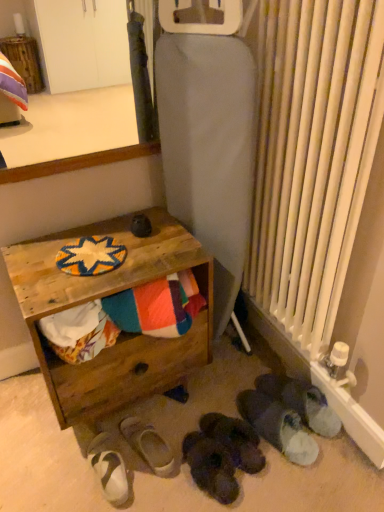
Question: Should I look upward or downward to see wooden surface at upper left?

Choices:
 (A) down
 (B) up

Answer: (B)

Question: Does white fabric slipper at lower center, which appears as the fifth footwear when viewed from the right, have a lesser height compared to black suede slippers at lower center, acting as the 4th footwear starting from the left?

Choices:
 (A) yes
 (B) no

Answer: (A)

Question: From the image's perspective, is white fabric slipper at lower center, the 2th footwear in the left-to-right sequence, on black suede slippers at lower center, positioned as the 3th footwear in right-to-left order?

Choices:
 (A) no
 (B) yes

Answer: (A)

Question: Is white fabric slipper at lower center, which appears as the fifth footwear when viewed from the right, behind black suede slippers at lower center, acting as the 4th footwear starting from the left?

Choices:
 (A) no
 (B) yes

Answer: (B)

Question: Does white fabric slipper at lower center, the 2th footwear in the left-to-right sequence, appear on the right side of black suede slippers at lower center, positioned as the 3th footwear in right-to-left order?

Choices:
 (A) no
 (B) yes

Answer: (A)

Question: Considering the relative sizes of white fabric slipper at lower center, the 2th footwear in the left-to-right sequence, and black suede slippers at lower center, positioned as the 3th footwear in right-to-left order, in the image provided, is white fabric slipper at lower center, the 2th footwear in the left-to-right sequence, smaller than black suede slippers at lower center, positioned as the 3th footwear in right-to-left order,?

Choices:
 (A) yes
 (B) no

Answer: (A)

Question: Is white fabric slipper at lower center, the 2th footwear in the left-to-right sequence, thinner than black suede slippers at lower center, positioned as the 3th footwear in right-to-left order?

Choices:
 (A) no
 (B) yes

Answer: (B)

Question: Can you confirm if wooden crate at lower left is bigger than white fuzzy slippers at lower right, which is the second footwear from right to left?

Choices:
 (A) no
 (B) yes

Answer: (B)

Question: From a real-world perspective, is wooden crate at lower left positioned over white fuzzy slippers at lower right, which is the second footwear from right to left, based on gravity?

Choices:
 (A) yes
 (B) no

Answer: (A)

Question: Considering the relative sizes of wooden crate at lower left and white fuzzy slippers at lower right, which is the second footwear from right to left, in the image provided, is wooden crate at lower left shorter than white fuzzy slippers at lower right, which is the second footwear from right to left,?

Choices:
 (A) yes
 (B) no

Answer: (B)

Question: From the image's perspective, does wooden crate at lower left appear higher than white fuzzy slippers at lower right, placed as the 5th footwear when sorted from left to right?

Choices:
 (A) no
 (B) yes

Answer: (B)

Question: Would you say wooden crate at lower left is a long distance from white fuzzy slippers at lower right, which is the second footwear from right to left?

Choices:
 (A) no
 (B) yes

Answer: (A)

Question: Is white fuzzy slippers at lower right, placed as the 5th footwear when sorted from left to right, at the back of wooden crate at lower left?

Choices:
 (A) yes
 (B) no

Answer: (B)

Question: Considering the relative positions of black suede slippers at lower center, acting as the 4th footwear starting from the left, and wooden surface at upper left in the image provided, is black suede slippers at lower center, acting as the 4th footwear starting from the left, to the left of wooden surface at upper left from the viewer's perspective?

Choices:
 (A) yes
 (B) no

Answer: (B)